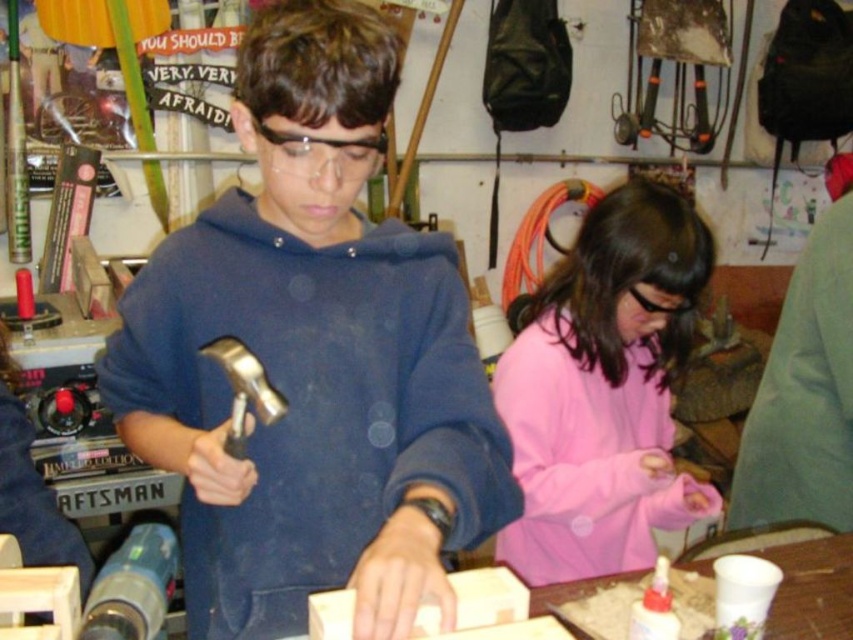
You are standing in the workshop and see the point marked at coordinates (x=312, y=356). What object is located at that point?

The point at coordinates (x=312, y=356) corresponds to the metallic hammer at center.